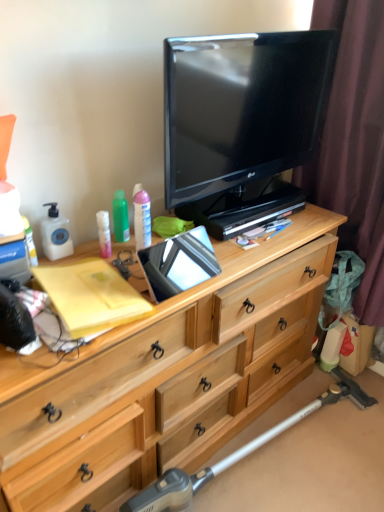
Question: Do you think matte plastic lotion at center, which is counted as the 1th toiletry, starting from the right, is within green plastic bottle at upper left, which appears as the 2th toiletry when viewed from the left, or outside of it?

Choices:
 (A) outside
 (B) inside

Answer: (A)

Question: From a real-world perspective, relative to green plastic bottle at upper left, which appears as the 2th toiletry when viewed from the left, is matte plastic lotion at center, the third toiletry viewed from the left, vertically above or below?

Choices:
 (A) above
 (B) below

Answer: (A)

Question: Which object is the closest to the brown fabric curtain at right?

Choices:
 (A) black glossy tv at upper center
 (B) matte plastic lotion at left, arranged as the third toiletry when viewed from the right
 (C) green plastic bottle at upper left, marked as the second toiletry in a right-to-left arrangement
 (D) matte plastic lotion at center, which is counted as the 1th toiletry, starting from the right
 (E) light wood dresser at center

Answer: (A)

Question: Estimate the real-world distances between objects in this image. Which object is farther from the matte plastic lotion at left, arranged as the third toiletry when viewed from the right?

Choices:
 (A) green plastic bottle at upper left, which appears as the 2th toiletry when viewed from the left
 (B) metallic silver vacuum cleaner at lower right
 (C) matte plastic lotion at center, the third toiletry viewed from the left
 (D) light wood dresser at center
 (E) brown fabric curtain at right

Answer: (E)